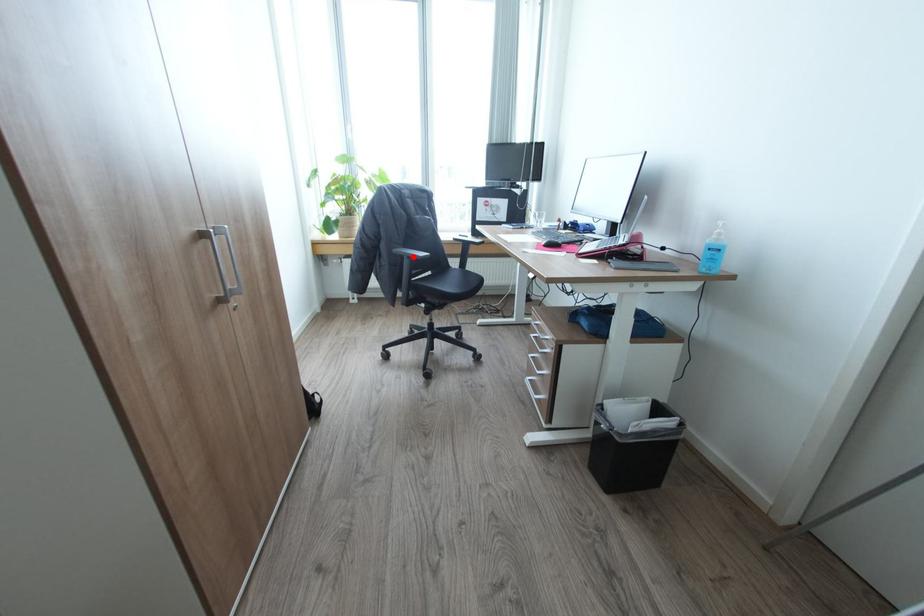
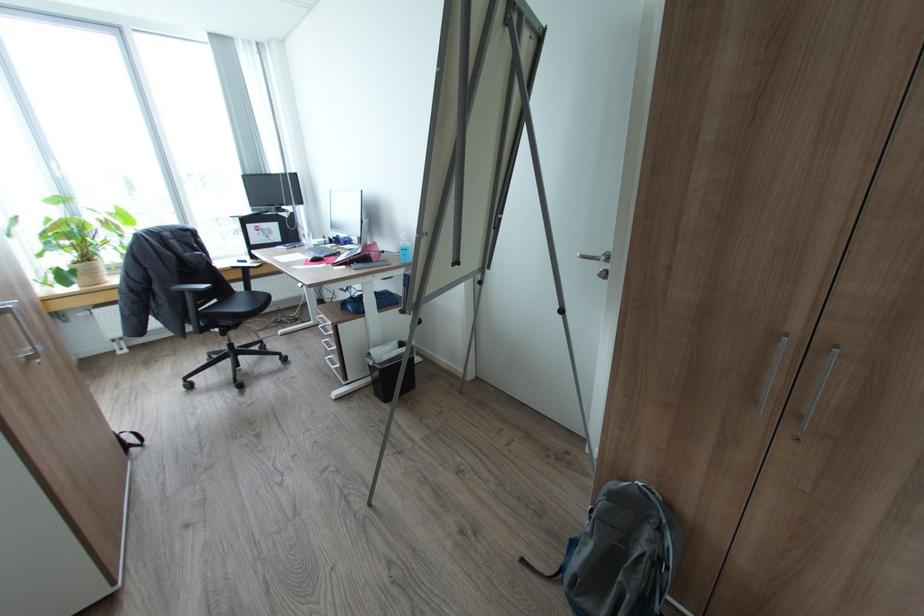
The point at the highlighted location is marked in the first image. Where is the corresponding point in the second image?

(195, 292)